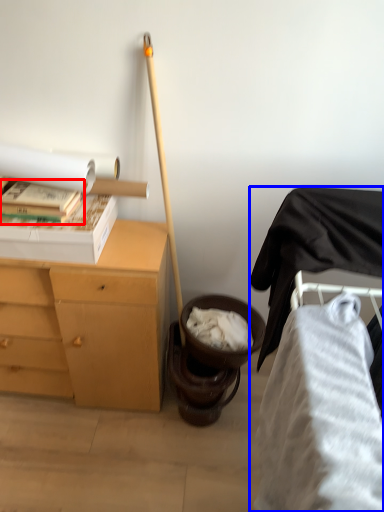
Question: Among these objects, which one is nearest to the camera, book (highlighted by a red box) or furniture (highlighted by a blue box)?

Choices:
 (A) book
 (B) furniture

Answer: (B)